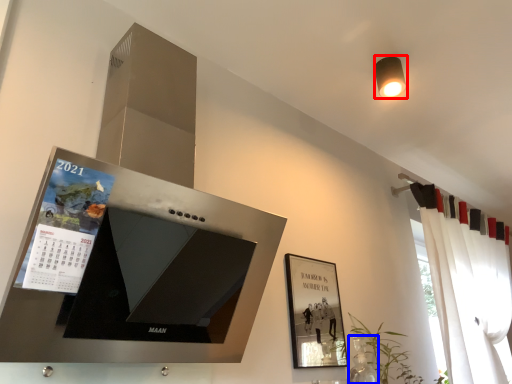
Question: Which of the following is the farthest to the observer, light fixture (highlighted by a red box) or glass vase (highlighted by a blue box)?

Choices:
 (A) light fixture
 (B) glass vase

Answer: (A)